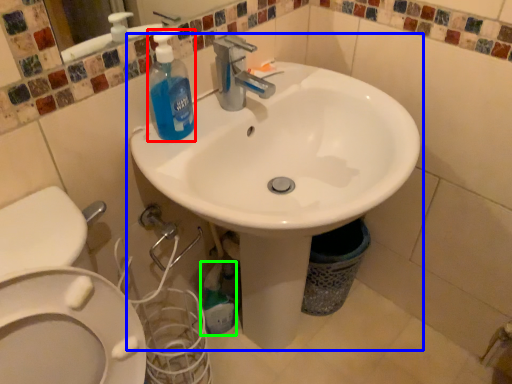
Question: Considering the real-world distances, which object is closest to cleaning product (highlighted by a red box)? sink (highlighted by a blue box) or cleaning product (highlighted by a green box).

Choices:
 (A) sink
 (B) cleaning product

Answer: (A)